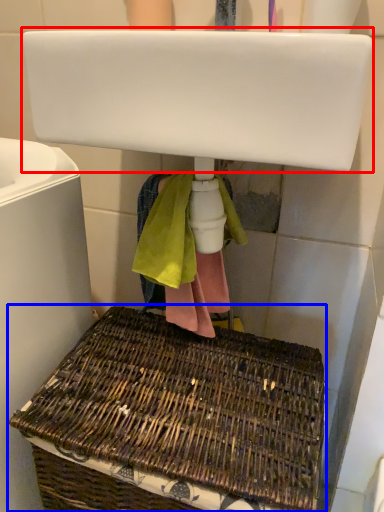
Question: Which object appears farthest to the camera in this image, sink (highlighted by a red box) or picnic basket (highlighted by a blue box)?

Choices:
 (A) sink
 (B) picnic basket

Answer: (B)